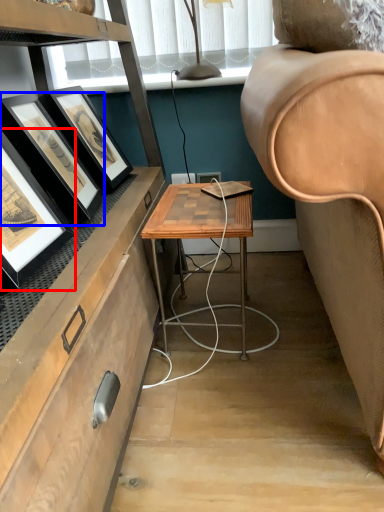
Question: Which object appears farthest to the camera in this image, picture frame (highlighted by a red box) or picture frame (highlighted by a blue box)?

Choices:
 (A) picture frame
 (B) picture frame

Answer: (B)